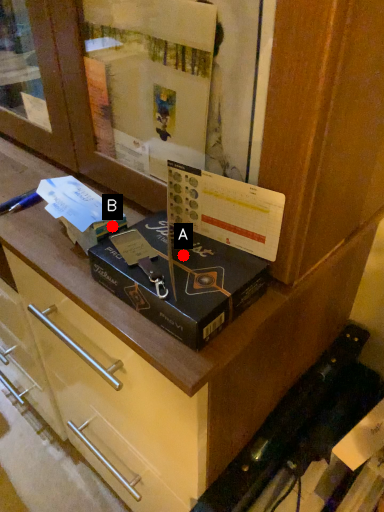
Question: Two points are circled on the image, labeled by A and B beside each circle. Among these points, which one is farthest from the camera?

Choices:
 (A) A is further
 (B) B is further

Answer: (B)